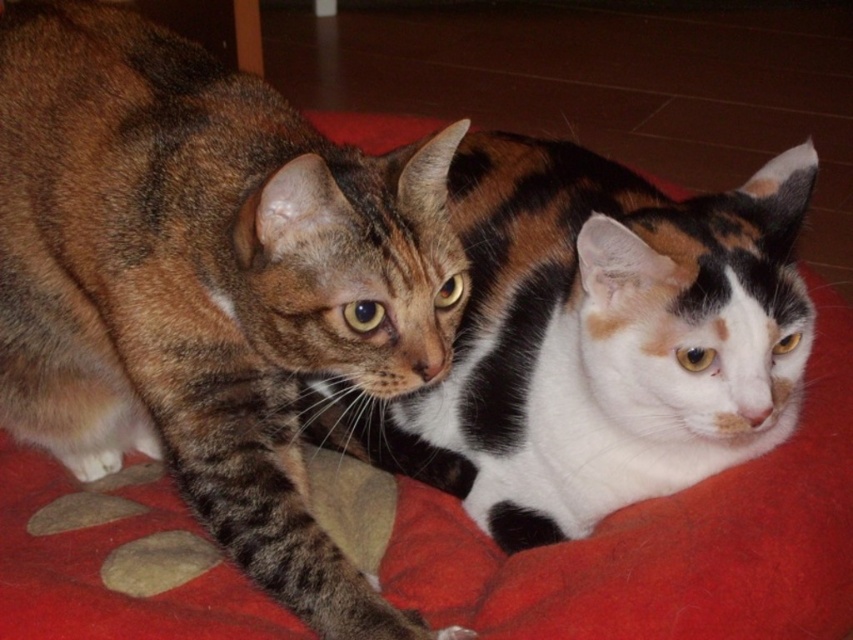
Who is positioned more to the right, tabby fur cat at left or tabby fur cat at center?

tabby fur cat at center is more to the right.

Which is above, tabby fur cat at left or tabby fur cat at center?

Positioned higher is tabby fur cat at center.

Is point (292, 468) more distant than point (485, 464)?

No, it is in front of (485, 464).

Identify the location of tabby fur cat at left. The width and height of the screenshot is (853, 640). (207, 284).